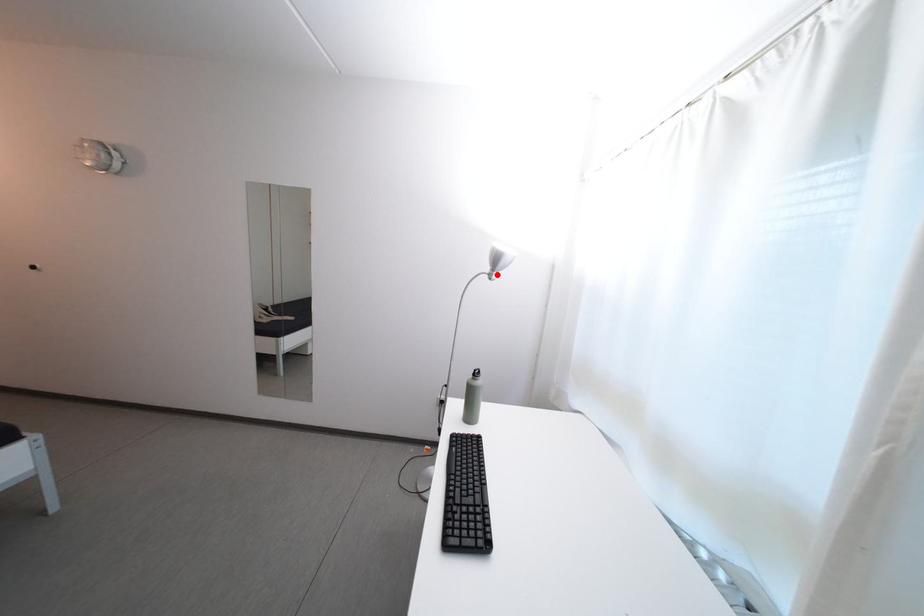
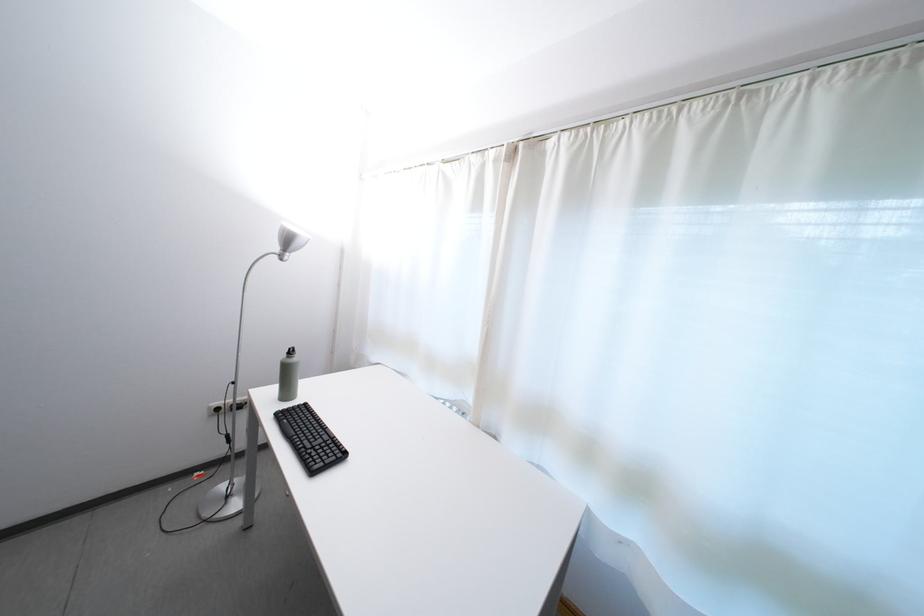
The point at the highlighted location is marked in the first image. Where is the corresponding point in the second image?

(286, 254)